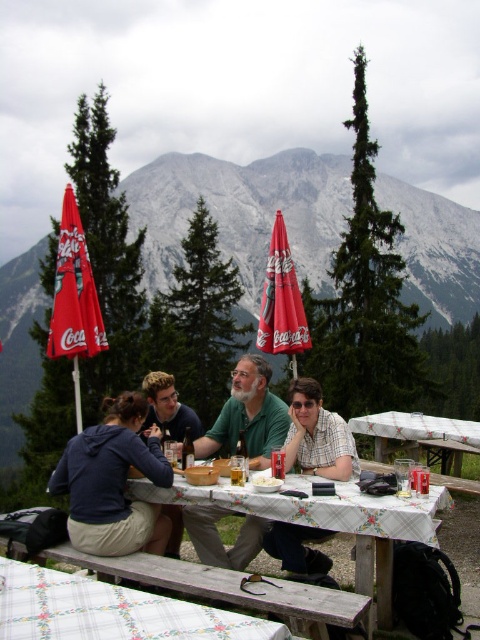
Question: Which of the following is the farthest from the observer?

Choices:
 (A) (295, 540)
 (B) (252, 394)
 (C) (377, 456)
 (D) (13, 618)

Answer: (C)

Question: Among these objects, which one is farthest from the camera?

Choices:
 (A) translucent glass bottle at table center
 (B) metallic silver can at table center
 (C) floral-patterned wood table at center

Answer: (A)

Question: Which point is farther to the camera?

Choices:
 (A) (257, 488)
 (B) (425, 305)

Answer: (B)

Question: Does checkered fabric shirt at center appear over translucent glass cup at table center?

Choices:
 (A) yes
 (B) no

Answer: (A)

Question: Is white matte bowl at center to the left of metallic silver can at table center from the viewer's perspective?

Choices:
 (A) no
 (B) yes

Answer: (B)

Question: Does green textured pine tree at upper center appear on the right side of translucent glass cup at table center?

Choices:
 (A) yes
 (B) no

Answer: (A)